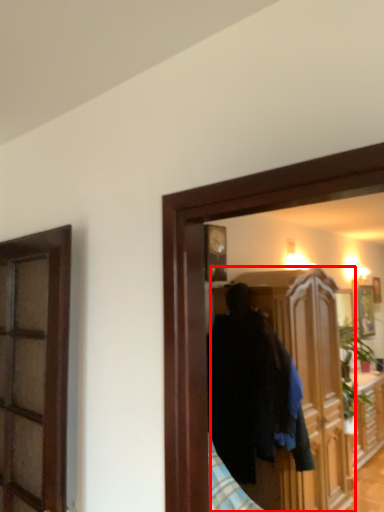
Question: From the image's perspective, what is the correct spatial relationship of cabinetry (annotated by the red box) in relation to picture frame?

Choices:
 (A) above
 (B) below

Answer: (B)